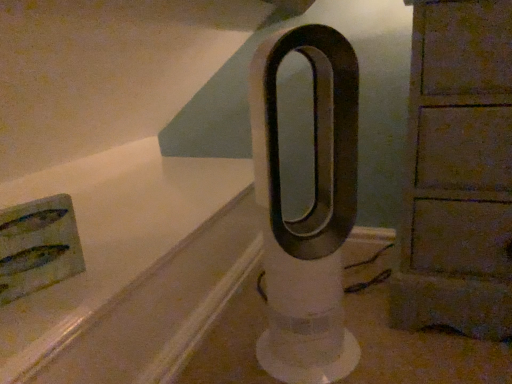
Question: Based on their sizes in the image, would you say wooden cabinet at right is bigger or smaller than white plastic fan at center?

Choices:
 (A) big
 (B) small

Answer: (A)

Question: In terms of height, does wooden cabinet at right look taller or shorter compared to white plastic fan at center?

Choices:
 (A) tall
 (B) short

Answer: (A)

Question: Considering the relative positions of wooden cabinet at right and white plastic fan at center in the image provided, is wooden cabinet at right to the left or to the right of white plastic fan at center?

Choices:
 (A) left
 (B) right

Answer: (B)

Question: In terms of width, does white plastic fan at center look wider or thinner when compared to wooden cabinet at right?

Choices:
 (A) thin
 (B) wide

Answer: (A)

Question: Considering their positions, is white plastic fan at center located in front of or behind wooden cabinet at right?

Choices:
 (A) front
 (B) behind

Answer: (A)

Question: From a real-world perspective, is white plastic fan at center physically located above or below wooden cabinet at right?

Choices:
 (A) above
 (B) below

Answer: (B)

Question: In terms of height, does white plastic fan at center look taller or shorter compared to wooden cabinet at right?

Choices:
 (A) short
 (B) tall

Answer: (A)